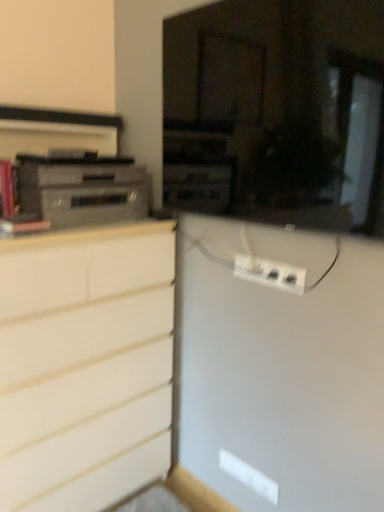
Question: Is white matte chest of drawers at left inside or outside of white plastic power strip at center?

Choices:
 (A) outside
 (B) inside

Answer: (A)

Question: Considering the positions of white matte chest of drawers at left and white plastic power strip at center in the image, is white matte chest of drawers at left taller or shorter than white plastic power strip at center?

Choices:
 (A) short
 (B) tall

Answer: (B)

Question: Which is nearer to the satin silver stereo at left?

Choices:
 (A) white matte chest of drawers at left
 (B) white plastic power strip at center

Answer: (A)

Question: Based on their relative distances, which object is nearer to the satin silver stereo at left?

Choices:
 (A) white matte chest of drawers at left
 (B) white plastic power strip at center

Answer: (A)